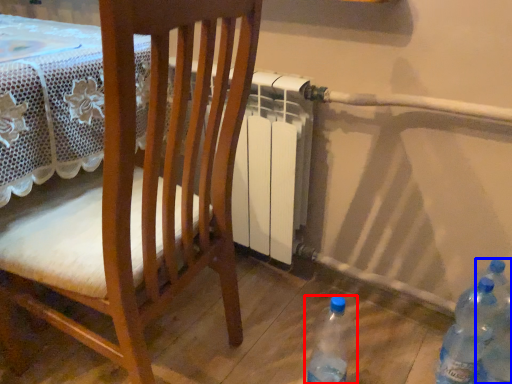
Question: Which object is closer to the camera taking this photo, bottle (highlighted by a red box) or bottle (highlighted by a blue box)?

Choices:
 (A) bottle
 (B) bottle

Answer: (B)